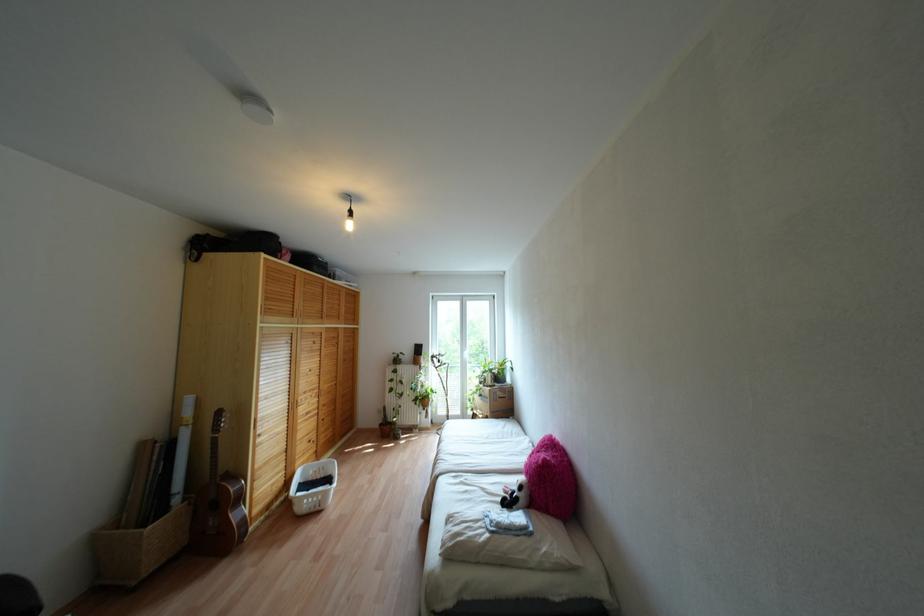
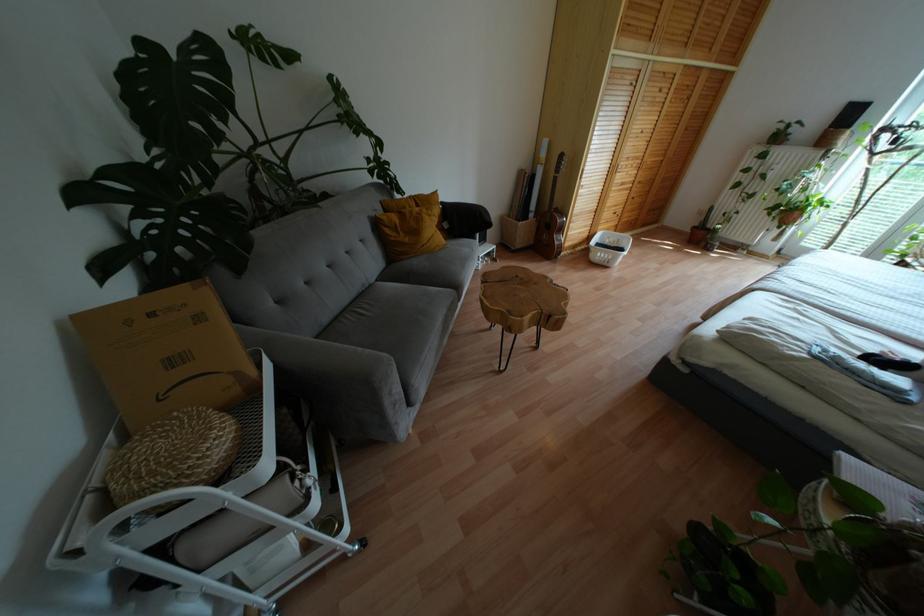
Where in the second image is the point corresponding to pixel 380 424 from the first image?

(694, 227)